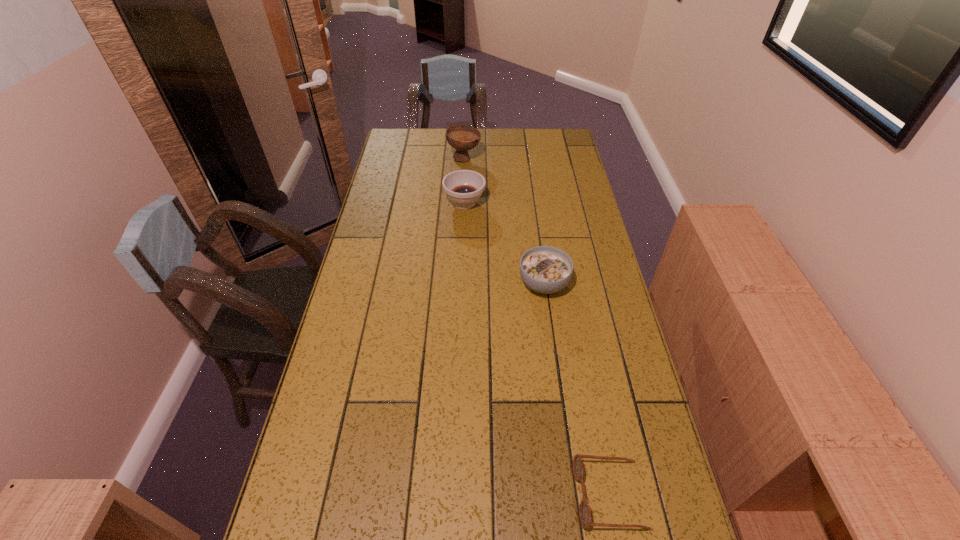
Identify which object is located as the nearest to the farthest object. Please provide its 2D coordinates. Your answer should be formatted as a tuple, i.e. [(x, y)], where the tuple contains the x and y coordinates of a point satisfying the conditions above.

[(463, 187)]

Locate an element on the screen. The width and height of the screenshot is (960, 540). soup bowl that stands as the second closest to the nearest object is located at coordinates (463, 187).

Where is `soup bowl that is the second closest one to the farthest soup bowl`? This screenshot has height=540, width=960. soup bowl that is the second closest one to the farthest soup bowl is located at coordinates (544, 269).

You are a GUI agent. You are given a task and a screenshot of the screen. Output one action in this format:
    pyautogui.click(x=<x>, y=<y>)
    Task: Click on the free location that satisfies the following two spatial constraints: 1. on the front side of the second farthest soup bowl; 2. on the right side of the rightmost soup bowl
    This screenshot has height=540, width=960.
    Given the screenshot: What is the action you would take?
    pyautogui.click(x=462, y=284)